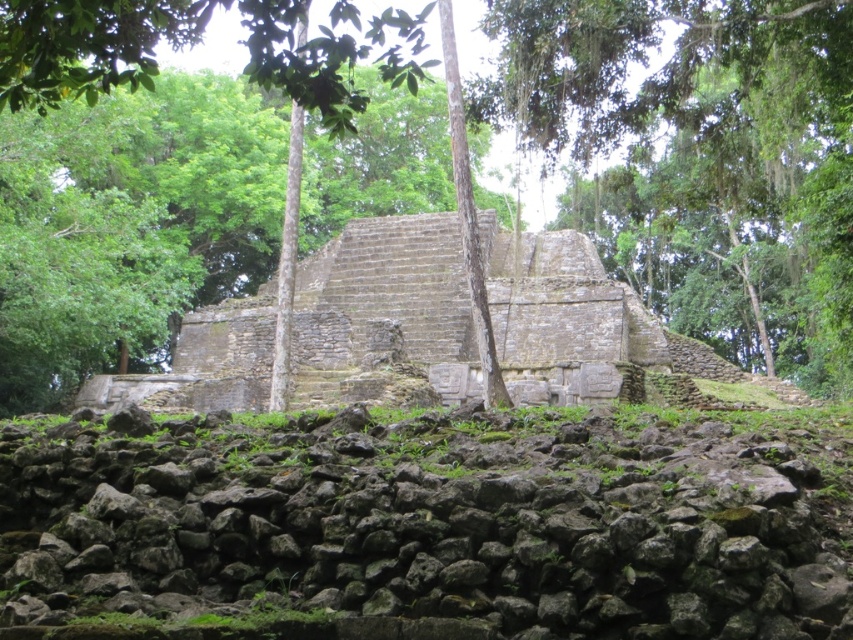
In the scene shown: Is rough stone wall at center wider than green leafy tree at center?

No, rough stone wall at center is not wider than green leafy tree at center.

Does rough stone wall at center appear under green leafy tree at center?

Yes, rough stone wall at center is below green leafy tree at center.

Between point (114, 630) and point (579, 51), which one is positioned behind?

Point (579, 51)

The height and width of the screenshot is (640, 853). Find the location of `rough stone wall at center`. rough stone wall at center is located at coordinates (430, 525).